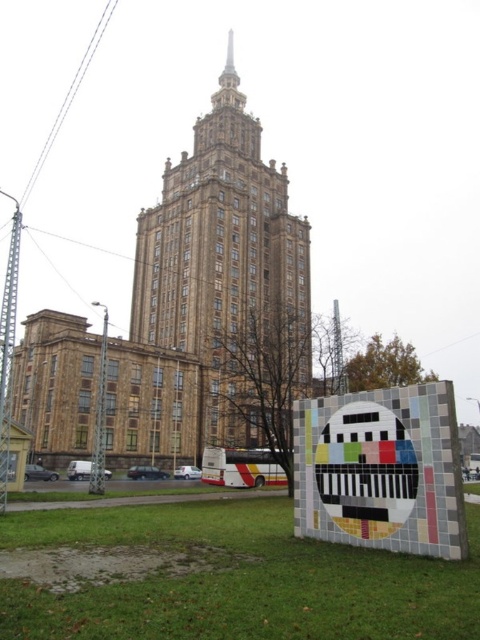
Between brown stone tower at center and multicolored mosaic sign at lower right, which one has more height?

Standing taller between the two is brown stone tower at center.

Can you confirm if brown stone tower at center is thinner than multicolored mosaic sign at lower right?

No, brown stone tower at center is not thinner than multicolored mosaic sign at lower right.

Does point (261, 282) lie behind point (330, 470)?

Yes, point (261, 282) is farther from viewer.

Locate an element on the screen. Image resolution: width=480 pixels, height=640 pixels. brown stone tower at center is located at coordinates (228, 275).